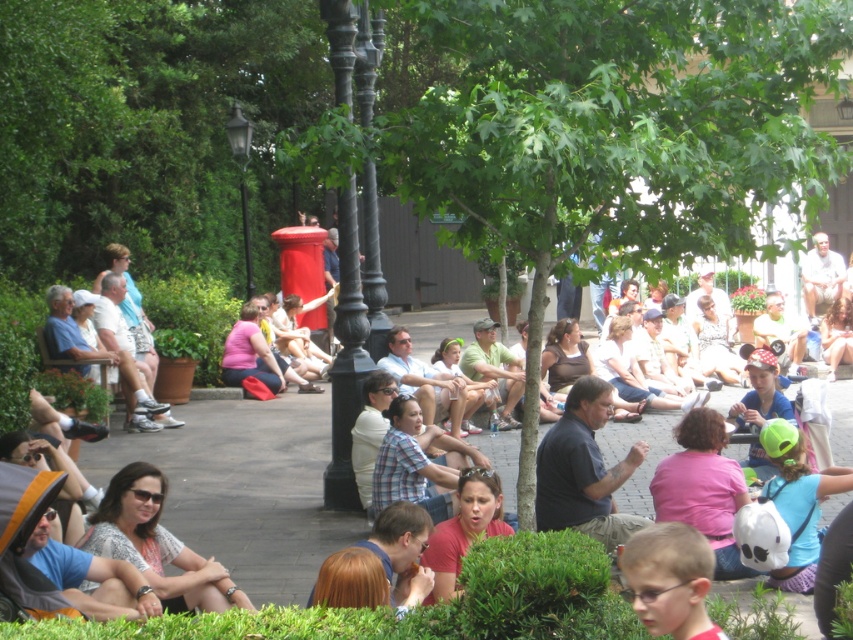
Question: Which point is closer to the camera?

Choices:
 (A) (833, 278)
 (B) (213, 611)

Answer: (B)

Question: Does patterned fabric shirt at center come behind light brown fabric pants at center?

Choices:
 (A) no
 (B) yes

Answer: (A)

Question: In this image, where is green leafy tree at center located relative to light brown fabric pants at center?

Choices:
 (A) below
 (B) above

Answer: (B)

Question: Considering the real-world distances, which object is closest to the patterned fabric shirt at center?

Choices:
 (A) green leafy tree at center
 (B) light brown fabric pants at center

Answer: (A)

Question: Can you confirm if green leafy tree at center is bigger than light brown fabric pants at center?

Choices:
 (A) no
 (B) yes

Answer: (B)

Question: Which point is farther from the camera taking this photo?

Choices:
 (A) (532, 38)
 (B) (155, 525)

Answer: (B)